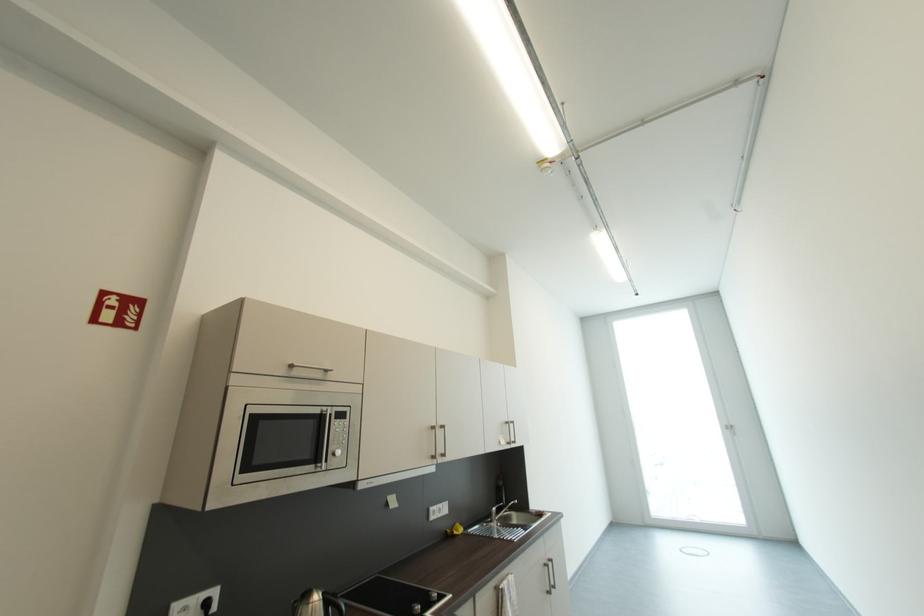
The height and width of the screenshot is (616, 924). What do you see at coordinates (338, 426) in the screenshot?
I see `the silver microwave dial` at bounding box center [338, 426].